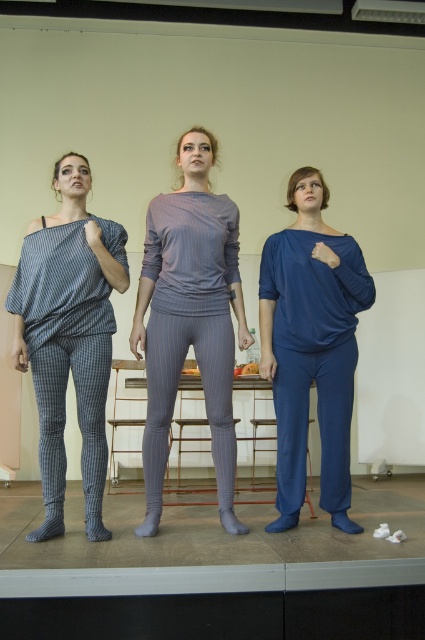
You are an event planner setting up a photo shoot for the three individuals on stage. You need to position a spotlight that can only illuminate objects within 1 meter of the front edge of the stage. The pinstriped fabric pants at center and matte blue pants at center are both on the stage. Based on their positions, will the spotlight reach both pants?

The pinstriped fabric pants at center is closer to the viewer than matte blue pants at center, so the spotlight will illuminate the pinstriped fabric pants at center but may not reach the matte blue pants at center if they are more than 1 meter away from the front edge.

You are an event planner setting up chairs for a small audience. You need to place chairs in front of the blue fabric stage at lower center so that they are not blocking the view of the matte blue pants at center. Based on the scene description, where should you position the chairs?

The blue fabric stage at lower center is to the left of matte blue pants at center. Therefore, positioning chairs in front of the blue fabric stage at lower center to the left side would ensure they don not block the view of the matte blue pants at center.

You are an event planner organizing a photoshoot and need to ensure that both the blue striped tights at center and the blue cotton pants at center are visible in the photo. Based on their positions, which one should you focus on to ensure both are visible?

The blue striped tights at center is in front of the blue cotton pants at center, so focusing on the blue striped tights at center will ensure both are visible as the cotton pants will be partially visible behind them.